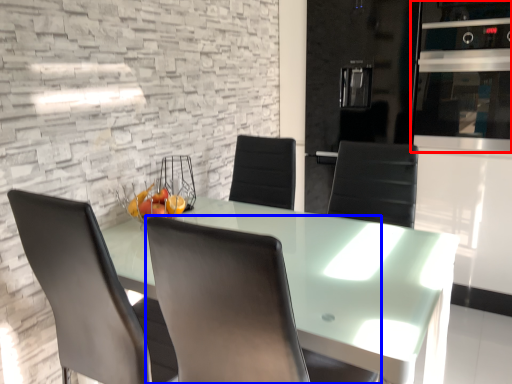
Question: Which point is closer to the camera, appliance (highlighted by a red box) or chair (highlighted by a blue box)?

Choices:
 (A) appliance
 (B) chair

Answer: (B)